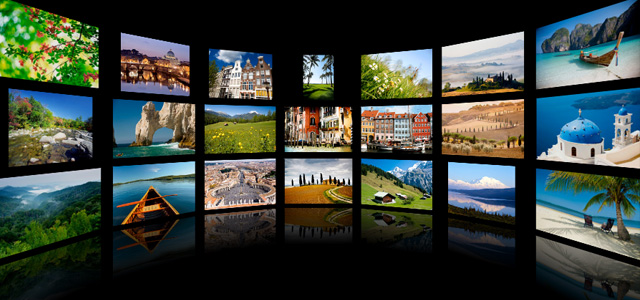
Where is `middle tv screens`? middle tv screens is located at coordinates pyautogui.click(x=249, y=74), pyautogui.click(x=251, y=136), pyautogui.click(x=250, y=183), pyautogui.click(x=328, y=179), pyautogui.click(x=321, y=122), pyautogui.click(x=321, y=64), pyautogui.click(x=394, y=70), pyautogui.click(x=397, y=129), pyautogui.click(x=390, y=184).